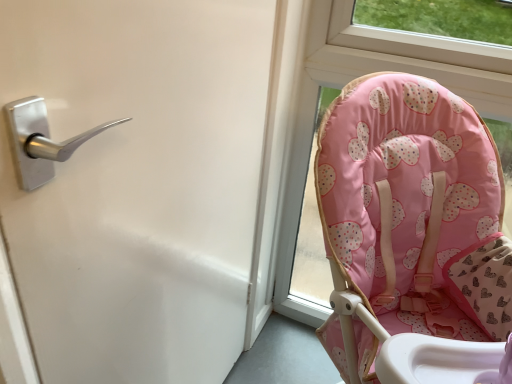
Question: From a real-world perspective, is silver metallic handle at upper left physically below pink fabric baby chair at right?

Choices:
 (A) yes
 (B) no

Answer: (A)

Question: Is the depth of silver metallic handle at upper left greater than that of pink fabric baby chair at right?

Choices:
 (A) no
 (B) yes

Answer: (A)

Question: Is silver metallic handle at upper left to the right of pink fabric baby chair at right from the viewer's perspective?

Choices:
 (A) no
 (B) yes

Answer: (A)

Question: Is silver metallic handle at upper left not close to pink fabric baby chair at right?

Choices:
 (A) yes
 (B) no

Answer: (B)

Question: Is silver metallic handle at upper left to the left of pink fabric baby chair at right from the viewer's perspective?

Choices:
 (A) yes
 (B) no

Answer: (A)

Question: Is pink fabric baby chair at right located within silver metallic handle at upper left?

Choices:
 (A) yes
 (B) no

Answer: (B)

Question: Considering the relative sizes of pink fabric baby chair at right and silver metallic handle at upper left in the image provided, is pink fabric baby chair at right taller than silver metallic handle at upper left?

Choices:
 (A) no
 (B) yes

Answer: (A)

Question: Can you confirm if pink fabric baby chair at right is positioned to the left of silver metallic handle at upper left?

Choices:
 (A) yes
 (B) no

Answer: (B)

Question: Is pink fabric baby chair at right positioned in front of silver metallic handle at upper left?

Choices:
 (A) no
 (B) yes

Answer: (A)

Question: Is pink fabric baby chair at right turned away from silver metallic handle at upper left?

Choices:
 (A) no
 (B) yes

Answer: (A)

Question: From a real-world perspective, is pink fabric baby chair at right on silver metallic handle at upper left?

Choices:
 (A) yes
 (B) no

Answer: (A)

Question: Is pink fabric baby chair at right shorter than silver metallic handle at upper left?

Choices:
 (A) yes
 (B) no

Answer: (A)

Question: From the image's perspective, relative to pink fabric baby chair at right, is silver metallic handle at upper left above or below?

Choices:
 (A) below
 (B) above

Answer: (A)